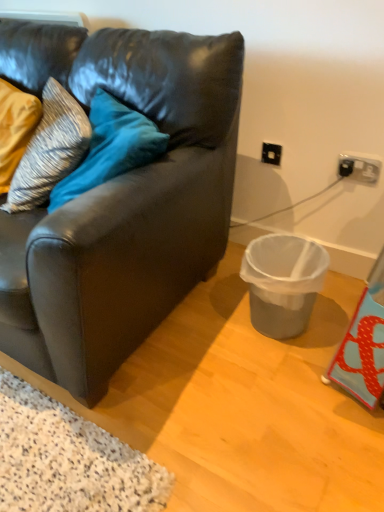
Find the location of `striped fabric pillow at left`. striped fabric pillow at left is located at coordinates (50, 150).

This screenshot has height=512, width=384. Describe the element at coordinates (50, 150) in the screenshot. I see `striped fabric pillow at left` at that location.

Locate an element on the screen. matte black couch at center is located at coordinates (123, 204).

Image resolution: width=384 pixels, height=512 pixels. Describe the element at coordinates (271, 153) in the screenshot. I see `black plastic electric outlet at upper right` at that location.

The height and width of the screenshot is (512, 384). What do you see at coordinates (359, 168) in the screenshot?
I see `black plastic power outlet at upper right` at bounding box center [359, 168].

Find the location of a particular element. Image resolution: width=384 pixels, height=512 pixels. striped fabric pillow at left is located at coordinates (50, 150).

Is point (264, 262) in front of point (358, 159)?

No, it is not.

Is black plastic power outlet at upper right completely or partially inside gray plastic trash can at lower right?

No, black plastic power outlet at upper right is not surrounded by gray plastic trash can at lower right.

Is gray plastic trash can at lower right aimed at black plastic power outlet at upper right?

No, gray plastic trash can at lower right is not facing towards black plastic power outlet at upper right.

Between gray plastic trash can at lower right and black plastic power outlet at upper right, which one has more height?

Standing taller between the two is gray plastic trash can at lower right.

In the scene shown: Could you tell me if matte black couch at center is turned towards black plastic power outlet at upper right?

No, matte black couch at center is not oriented towards black plastic power outlet at upper right.

How many degrees apart are the facing directions of matte black couch at center and black plastic power outlet at upper right?

1.35 degrees.

Is matte black couch at center far away from black plastic power outlet at upper right?

No, matte black couch at center is not far away from black plastic power outlet at upper right.

Does matte black couch at center lie behind black plastic power outlet at upper right?

No, matte black couch at center is closer to the viewer.

In the scene shown: Which point is more distant from viewer, (360,166) or (57,122)?

The point (360,166) is farther.

Is black plastic power outlet at upper right facing towards striped fabric pillow at left?

No, black plastic power outlet at upper right is not aimed at striped fabric pillow at left.

Considering the sizes of objects black plastic power outlet at upper right and striped fabric pillow at left in the image provided, who is smaller, black plastic power outlet at upper right or striped fabric pillow at left?

black plastic power outlet at upper right is smaller.

Locate an element on the screen. This screenshot has width=384, height=512. power outlet that is on the right side of striped fabric pillow at left is located at coordinates (359, 168).

Which is more to the right, gray plastic trash can at lower right or black plastic electric outlet at upper right?

From the viewer's perspective, black plastic electric outlet at upper right appears more on the right side.

Between gray plastic trash can at lower right and black plastic electric outlet at upper right, which one has smaller size?

With smaller size is black plastic electric outlet at upper right.

You are a GUI agent. You are given a task and a screenshot of the screen. Output one action in this format:
    pyautogui.click(x=<x>, y=<y>)
    Task: Click on the electric outlet behind the gray plastic trash can at lower right
    Image resolution: width=384 pixels, height=512 pixels.
    Given the screenshot: What is the action you would take?
    (271, 153)

How many degrees apart are the facing directions of gray plastic trash can at lower right and black plastic electric outlet at upper right?

The angle between the facing direction of gray plastic trash can at lower right and the facing direction of black plastic electric outlet at upper right is 0.468 degrees.

From the image's perspective, which object appears higher, black plastic electric outlet at upper right or matte black couch at center?

black plastic electric outlet at upper right appears higher in the image.

Between black plastic electric outlet at upper right and matte black couch at center, which one appears on the left side from the viewer's perspective?

matte black couch at center.

Considering the relative sizes of black plastic electric outlet at upper right and matte black couch at center in the image provided, is black plastic electric outlet at upper right taller than matte black couch at center?

No, black plastic electric outlet at upper right is not taller than matte black couch at center.

Considering the positions of objects black plastic electric outlet at upper right and matte black couch at center in the image provided, who is behind, black plastic electric outlet at upper right or matte black couch at center?

black plastic electric outlet at upper right is further away from the camera.

From the picture: Is black plastic electric outlet at upper right beside striped fabric pillow at left?

No, black plastic electric outlet at upper right is not beside striped fabric pillow at left.

This screenshot has width=384, height=512. I want to click on pillow that appears above the black plastic electric outlet at upper right (from the image's perspective), so click(50, 150).

Is striped fabric pillow at left completely or partially inside black plastic electric outlet at upper right?

No, black plastic electric outlet at upper right does not contain striped fabric pillow at left.

Does black plastic power outlet at upper right have a lesser width compared to matte black couch at center?

Correct, the width of black plastic power outlet at upper right is less than that of matte black couch at center.

Could you tell me if black plastic power outlet at upper right is turned towards matte black couch at center?

No, black plastic power outlet at upper right is not oriented towards matte black couch at center.

In terms of height, does black plastic power outlet at upper right look taller or shorter compared to matte black couch at center?

Clearly, black plastic power outlet at upper right is shorter compared to matte black couch at center.

From the image's perspective, is black plastic power outlet at upper right located above matte black couch at center?

Incorrect, from the image's perspective, black plastic power outlet at upper right is lower than matte black couch at center.

Find the location of a particular element. trash bin/can below the black plastic power outlet at upper right (from a real-world perspective) is located at coordinates (283, 282).

Locate an element on the screen. studio couch above the black plastic power outlet at upper right (from the image's perspective) is located at coordinates (123, 204).

Which object lies nearer to the anchor point gray plastic trash can at lower right, matte black couch at center or black plastic power outlet at upper right?

The object closer to gray plastic trash can at lower right is matte black couch at center.

Looking at the image, which one is located further to black plastic power outlet at upper right, black plastic electric outlet at upper right or striped fabric pillow at left?

striped fabric pillow at left lies further to black plastic power outlet at upper right than the other object.

When comparing their distances from striped fabric pillow at left, does black plastic power outlet at upper right or gray plastic trash can at lower right seem closer?

Among the two, gray plastic trash can at lower right is located nearer to striped fabric pillow at left.

Considering their positions, is striped fabric pillow at left positioned further to gray plastic trash can at lower right than black plastic electric outlet at upper right?

striped fabric pillow at left is positioned further to the anchor gray plastic trash can at lower right.

Considering their positions, is black plastic electric outlet at upper right positioned closer to striped fabric pillow at left than matte black couch at center?

Among the two, matte black couch at center is located nearer to striped fabric pillow at left.

Estimate the real-world distances between objects in this image. Which object is closer to black plastic electric outlet at upper right, black plastic power outlet at upper right or matte black couch at center?

black plastic power outlet at upper right.

Based on the photo, from the image, which object appears to be farther from striped fabric pillow at left, matte black couch at center or gray plastic trash can at lower right?

Among the two, gray plastic trash can at lower right is located further to striped fabric pillow at left.

Consider the image. Which object lies further to the anchor point matte black couch at center, striped fabric pillow at left or gray plastic trash can at lower right?

The object further to matte black couch at center is gray plastic trash can at lower right.

This screenshot has height=512, width=384. I want to click on studio couch between striped fabric pillow at left and black plastic power outlet at upper right in the horizontal direction, so click(x=123, y=204).

In order to click on trash bin/can located between striped fabric pillow at left and black plastic power outlet at upper right in the left-right direction in this screenshot , I will do `click(283, 282)`.

Image resolution: width=384 pixels, height=512 pixels. I want to click on studio couch between striped fabric pillow at left and black plastic electric outlet at upper right, so click(x=123, y=204).

Identify the location of power outlet between black plastic electric outlet at upper right and gray plastic trash can at lower right in the up-down direction. point(359,168).